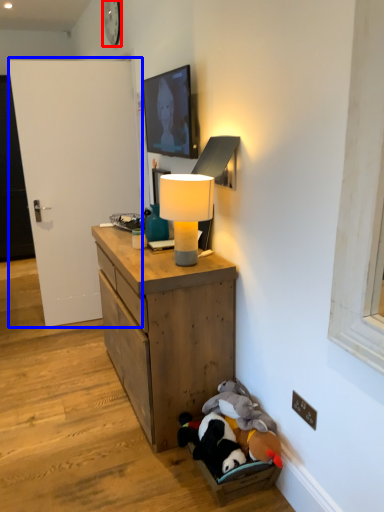
Question: Which point is closer to the camera, clock (highlighted by a red box) or door (highlighted by a blue box)?

Choices:
 (A) clock
 (B) door

Answer: (B)